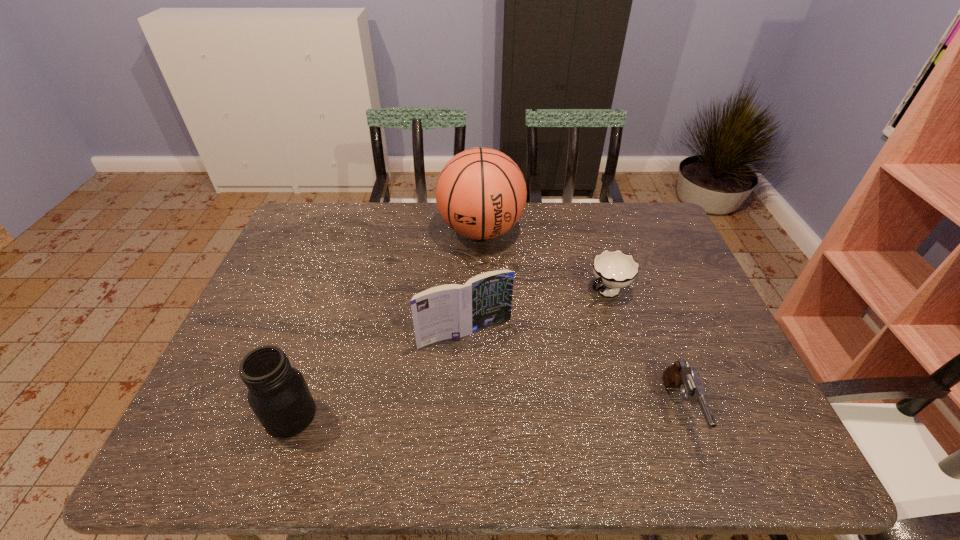
Locate an element on the screen. jar is located at coordinates (278, 394).

Locate an element on the screen. This screenshot has width=960, height=540. pistol is located at coordinates (679, 375).

The width and height of the screenshot is (960, 540). I want to click on basketball, so click(x=481, y=193).

The image size is (960, 540). In order to click on the tallest object in this screenshot , I will do `click(481, 193)`.

Where is `the third nearest object`? The width and height of the screenshot is (960, 540). the third nearest object is located at coordinates (447, 311).

Where is `the second farthest object`? This screenshot has width=960, height=540. the second farthest object is located at coordinates (613, 270).

Identify the location of cup. This screenshot has width=960, height=540. click(x=613, y=270).

Where is `vacant region located 0.080m on the right of the leftmost object`? This screenshot has width=960, height=540. vacant region located 0.080m on the right of the leftmost object is located at coordinates (352, 415).

The width and height of the screenshot is (960, 540). In order to click on blank space located on the surface of the basketball near the brand logo in this screenshot , I will do `click(486, 291)`.

Locate an element on the screen. This screenshot has height=540, width=960. vacant space located on the surface of the basketball near the brand logo is located at coordinates (491, 363).